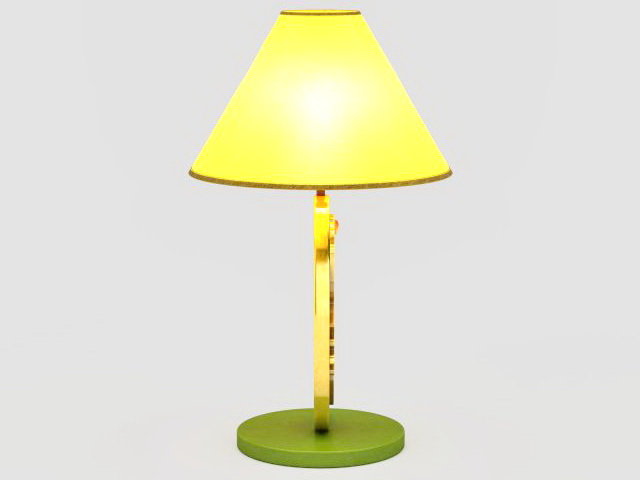
Identify the location of lamp to lightbulb connection. (320, 195).